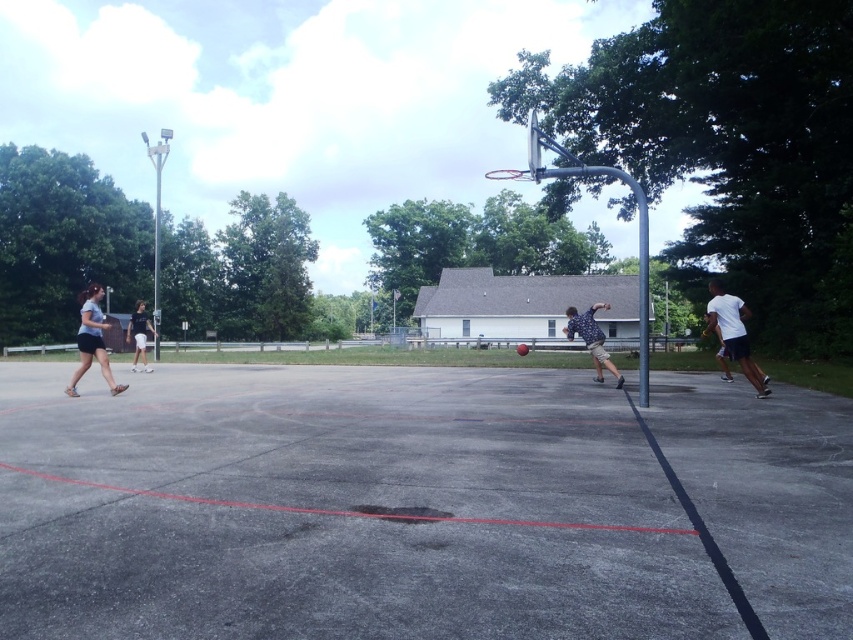
Question: Does gray concrete court at center appear on the left side of silver metallic basketball hoop at center?

Choices:
 (A) yes
 (B) no

Answer: (A)

Question: Which point is farther from the camera taking this photo?

Choices:
 (A) (26, 541)
 (B) (596, 353)
 (C) (567, 173)

Answer: (B)

Question: Estimate the real-world distances between objects in this image. Which object is closer to the patterned shirt at center?

Choices:
 (A) gray concrete court at center
 (B) white matte shirt at right
 (C) silver metallic basketball hoop at center

Answer: (B)

Question: Which point is farther to the camera?

Choices:
 (A) (126, 337)
 (B) (567, 317)
 (C) (635, 192)

Answer: (A)

Question: Does gray concrete court at center have a larger size compared to white cotton shorts at left?

Choices:
 (A) yes
 (B) no

Answer: (B)

Question: Is gray concrete court at center thinner than silver metallic basketball hoop at center?

Choices:
 (A) no
 (B) yes

Answer: (B)